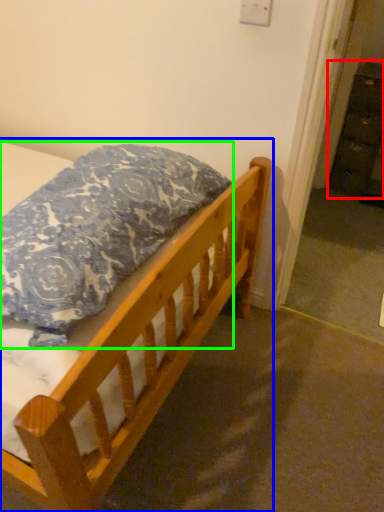
Question: Based on their relative distances, which object is nearer to dresser (highlighted by a red box)? Choose from bed (highlighted by a blue box) and pillow (highlighted by a green box).

Choices:
 (A) bed
 (B) pillow

Answer: (A)